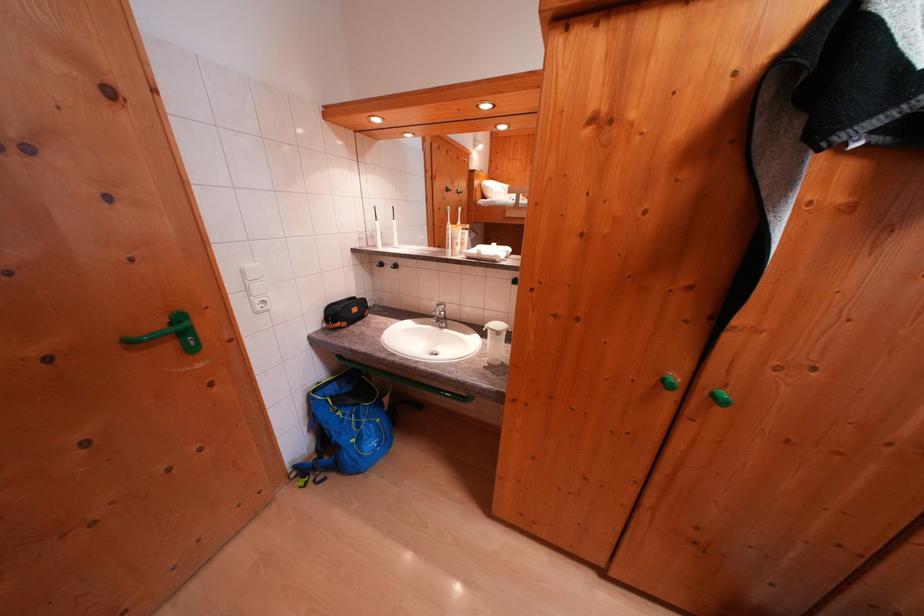
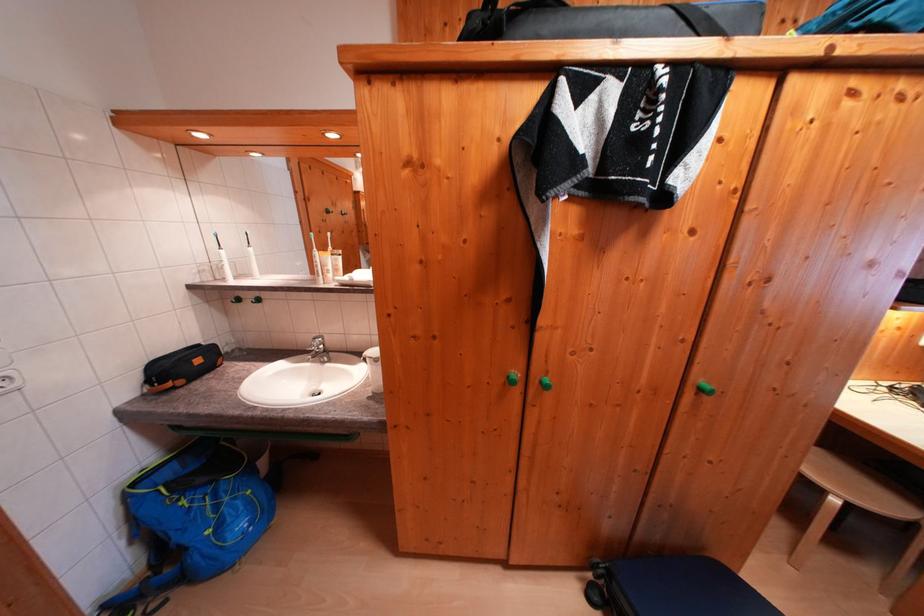
Find the pixel in the second image that matches (322,395) in the first image.

(142, 488)